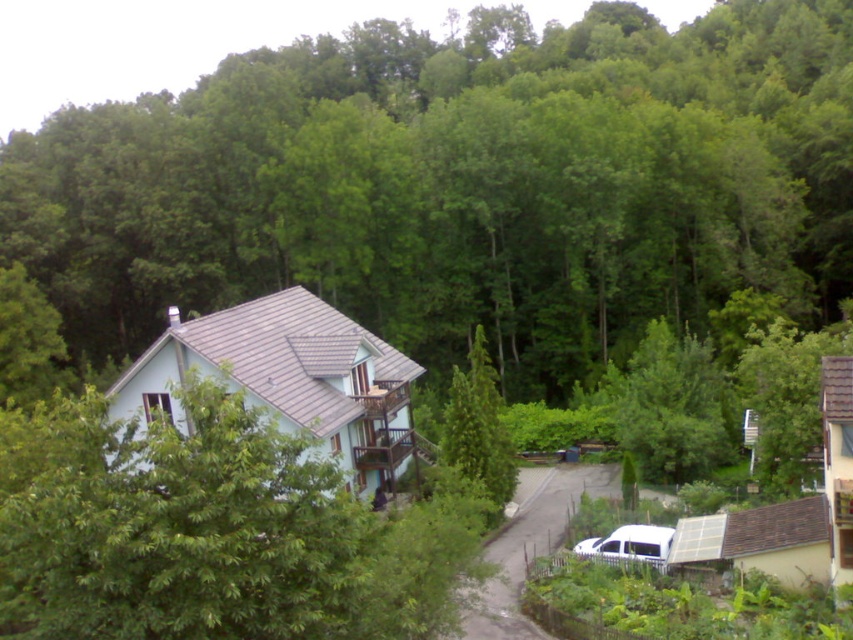
Question: Which of these objects is positioned closest to the green leafy tree at center?

Choices:
 (A) green textured tree at center
 (B) white matte van at lower right

Answer: (A)

Question: Which object is farther from the camera taking this photo?

Choices:
 (A) white matte van at lower right
 (B) green leafy tree at center

Answer: (B)

Question: In this image, where is green leafy tree at center located relative to green textured tree at center?

Choices:
 (A) right
 (B) left

Answer: (A)

Question: Can you confirm if green textured tree at center is thinner than white matte van at lower right?

Choices:
 (A) yes
 (B) no

Answer: (B)

Question: Which point is closer to the camera?

Choices:
 (A) (647, 52)
 (B) (590, 556)

Answer: (B)

Question: Does green leafy tree at center come in front of white matte van at lower right?

Choices:
 (A) no
 (B) yes

Answer: (A)